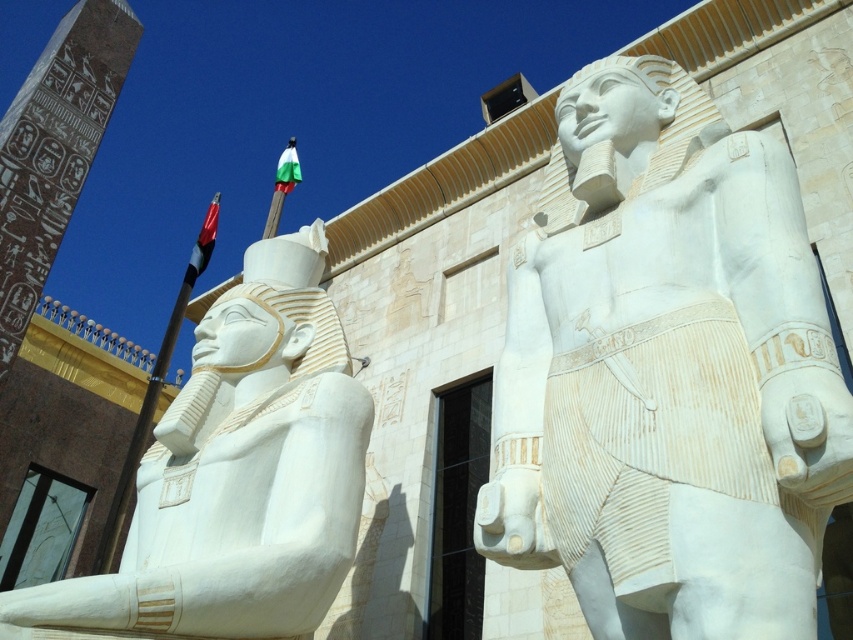
You are standing in front of the building with two statues. There is a point at coordinates [666,372]. What is located at that point?

At point [666,372] lies the white marble statue at center.

You are an architect assessing the statues in front of the classical building. You need to determine which statue is taller between the white marble statue at center and the white marble statue at left. Based on the scene, which one is taller?

The white marble statue at center is much taller than the white marble statue at left according to the description.